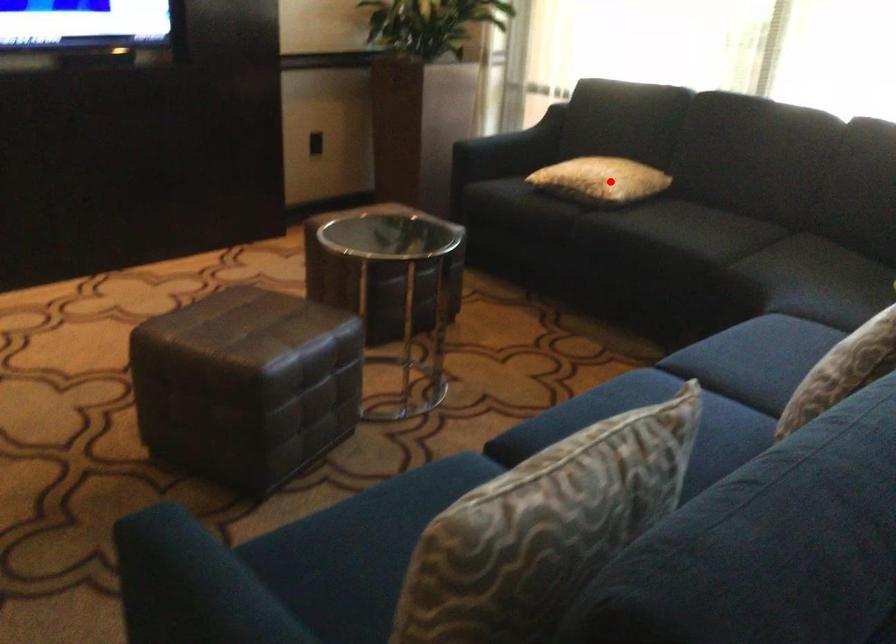
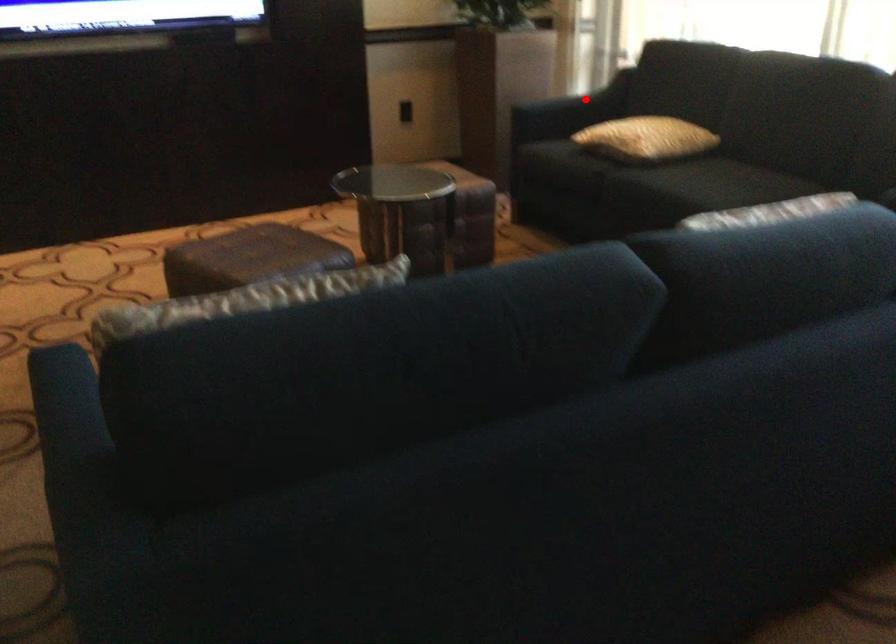
I am providing you with two images of the same scene from different viewpoints. A red point is marked on the first image and another point is marked on the second image. Do the highlighted points in image1 and image2 indicate the same real-world spot?

No